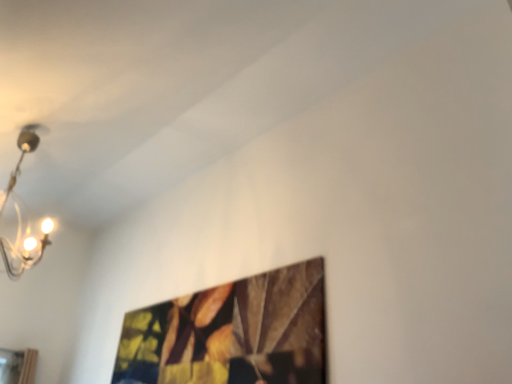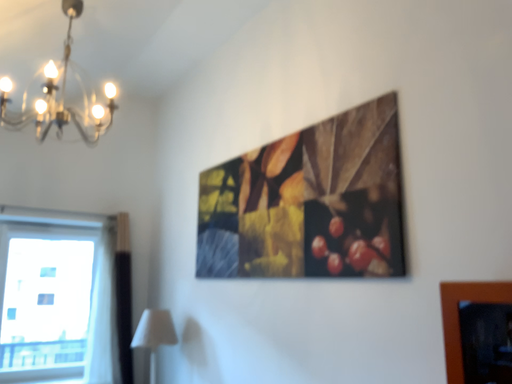
Question: How did the camera likely rotate when shooting the video?

Choices:
 (A) rotated downward
 (B) rotated upward

Answer: (A)